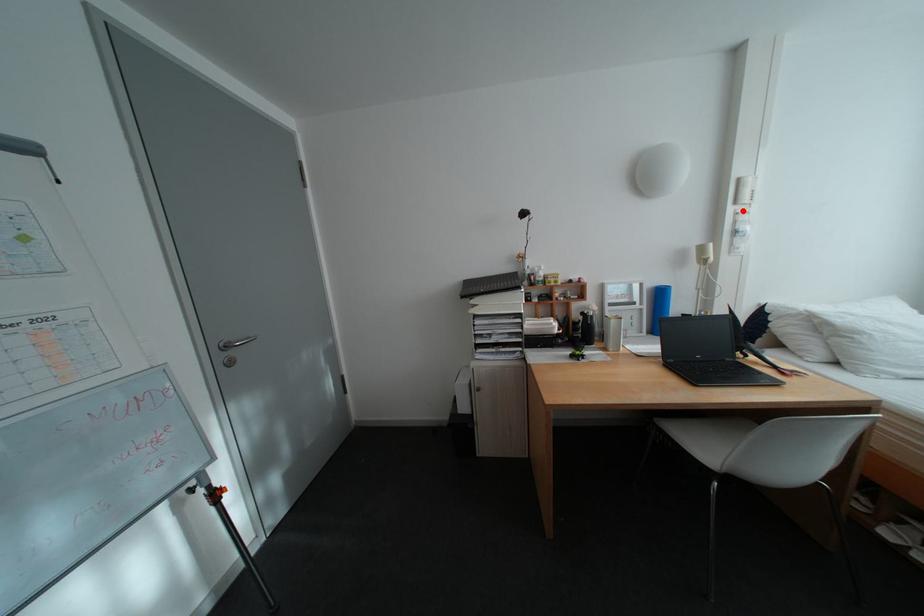
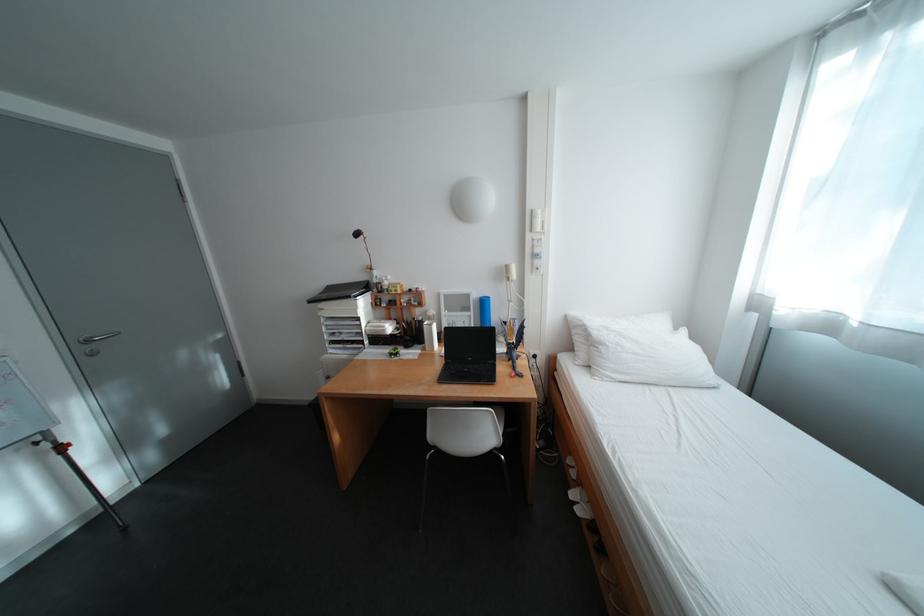
Locate, in the second image, the point that corresponds to the highlighted location in the first image.

(541, 237)